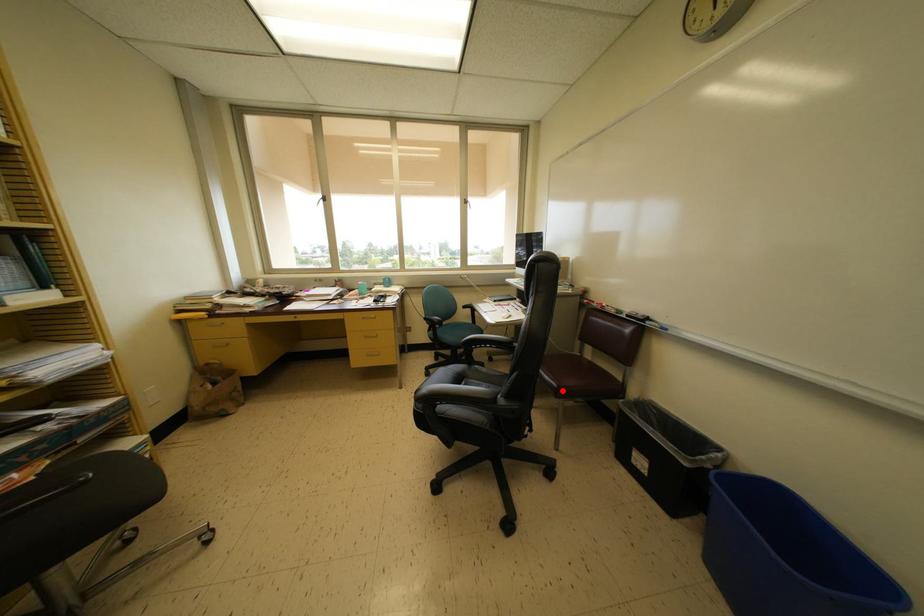
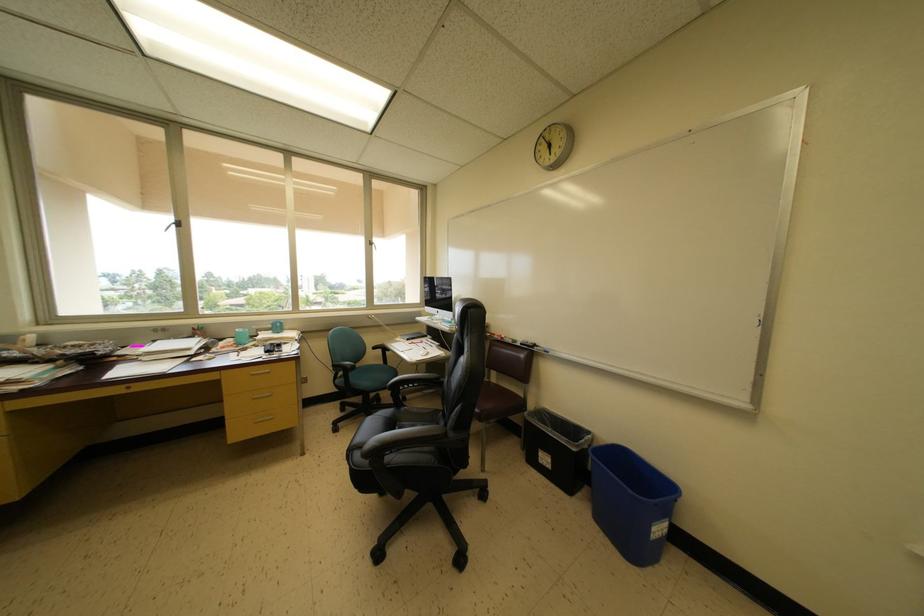
Question: I am providing you with two images of the same scene from different viewpoints. Given a red point in image1, look at the same physical point in image2. Is it:

Choices:
 (A) Closer to the viewpoint
 (B) Farther from the viewpoint

Answer: (A)